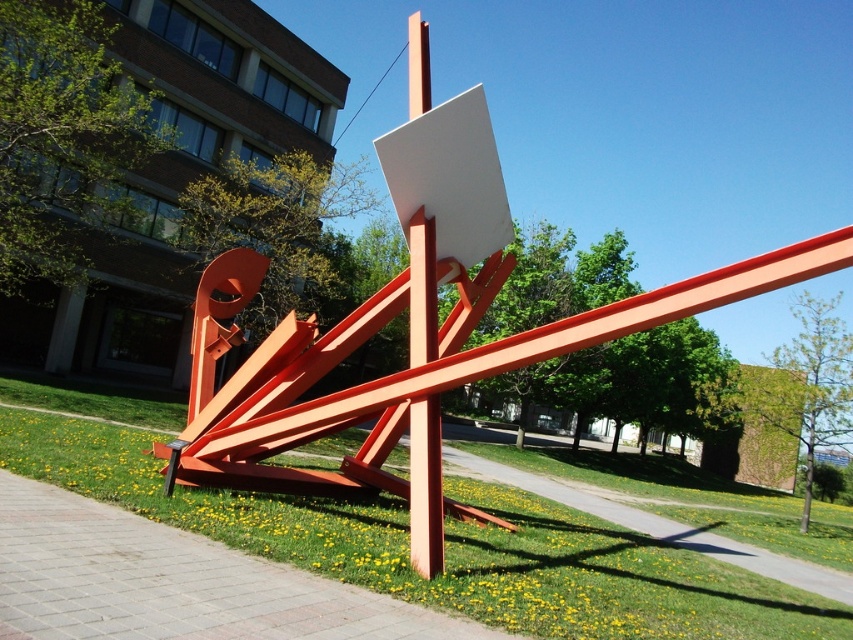
You are a landscape architect designing a garden around the sculpture. You need to ensure that the green grass at lower center is visible from the base of the matte orange pole at center. Given their height difference, will the grass be visible from there?

The green grass at lower center is shorter than the matte orange pole at center, so the grass will be visible from the base of the matte orange pole at center since it is not obstructed by its height.

You are an art student analyzing the sculpture in the image. You notice two orange elements at the center of the sculpture. Can you determine which one is positioned lower between the orange metallic sculpture at center and the matte orange pole at center?

The orange metallic sculpture at center is located below the matte orange pole at center, so the orange metallic sculpture at center is positioned lower than the matte orange pole at center.

You are an art student analyzing the sculpture in the image. You notice two orange elements at the center of the scene. Which one is smaller in size between the orange metallic sculpture at center and the matte orange pole at center?

The orange metallic sculpture at center is smaller in size compared to the matte orange pole at center according to the description.